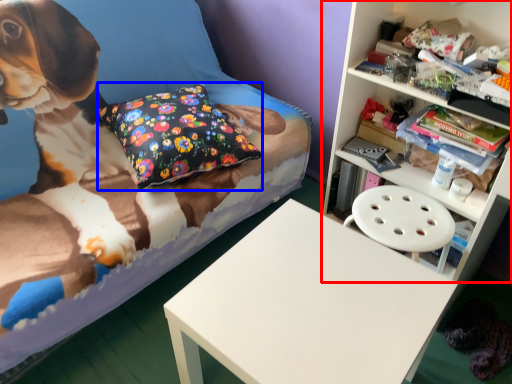
Question: Among these objects, which one is farthest to the camera, shelf (highlighted by a red box) or pillow (highlighted by a blue box)?

Choices:
 (A) shelf
 (B) pillow

Answer: (B)